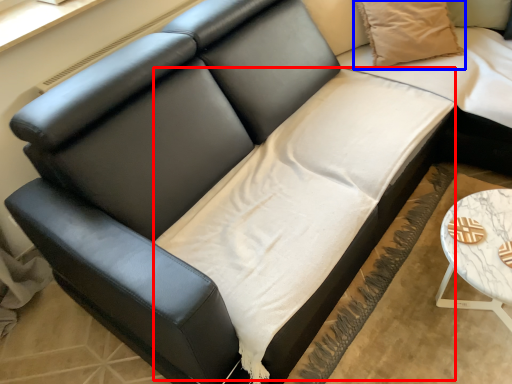
Question: Which of the following is the farthest to the observer, sheet (highlighted by a red box) or pillow (highlighted by a blue box)?

Choices:
 (A) sheet
 (B) pillow

Answer: (B)